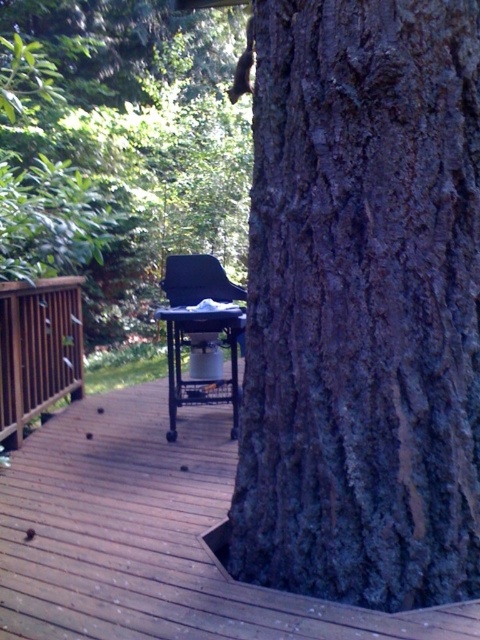
Can you confirm if brown wooden deck at center is wider than matte black barbecue grill at center?

Yes.

Describe the element at coordinates (152, 538) in the screenshot. The width and height of the screenshot is (480, 640). I see `brown wooden deck at center` at that location.

Where is `brown wooden deck at center`? This screenshot has width=480, height=640. brown wooden deck at center is located at coordinates (152, 538).

In the scene shown: Is brown wooden deck at center wider than brown wooden rail at left?

Correct, the width of brown wooden deck at center exceeds that of brown wooden rail at left.

How distant is brown wooden deck at center from brown wooden rail at left?

A distance of 34.33 inches exists between brown wooden deck at center and brown wooden rail at left.

Identify the location of brown wooden deck at center. (152, 538).

Locate an element on the screen. The width and height of the screenshot is (480, 640). brown wooden deck at center is located at coordinates (152, 538).

Describe the element at coordinates (362, 305) in the screenshot. Image resolution: width=480 pixels, height=640 pixels. I see `dark gray bark at center` at that location.

Between dark gray bark at center and brown wooden deck at center, which one has more height?

With more height is dark gray bark at center.

Does point (464, 220) lie in front of point (90, 508)?

Yes, it is in front of point (90, 508).

Where is `dark gray bark at center`? The width and height of the screenshot is (480, 640). dark gray bark at center is located at coordinates (362, 305).